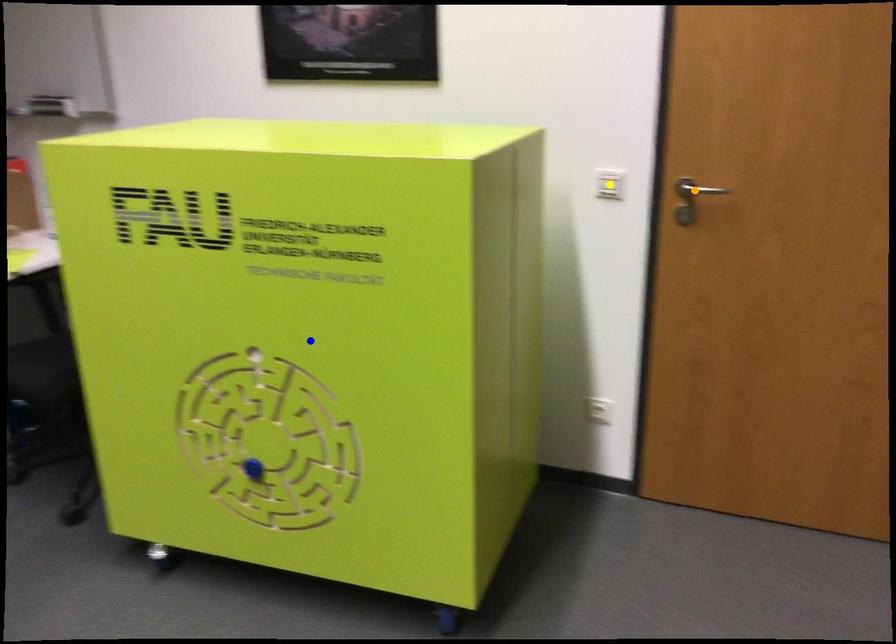
Order these from nearest to farthest:
A) blue point
B) yellow point
C) orange point

yellow point
orange point
blue point